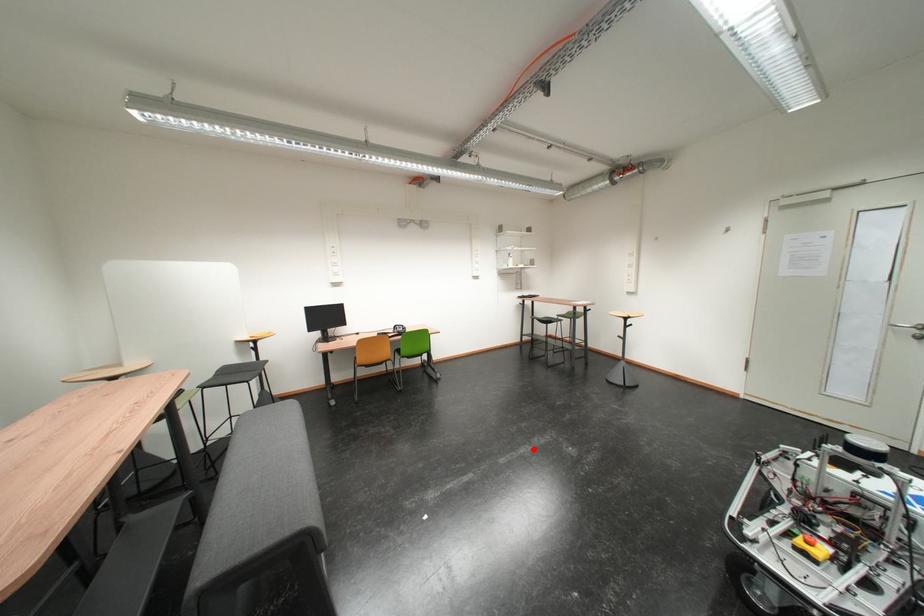
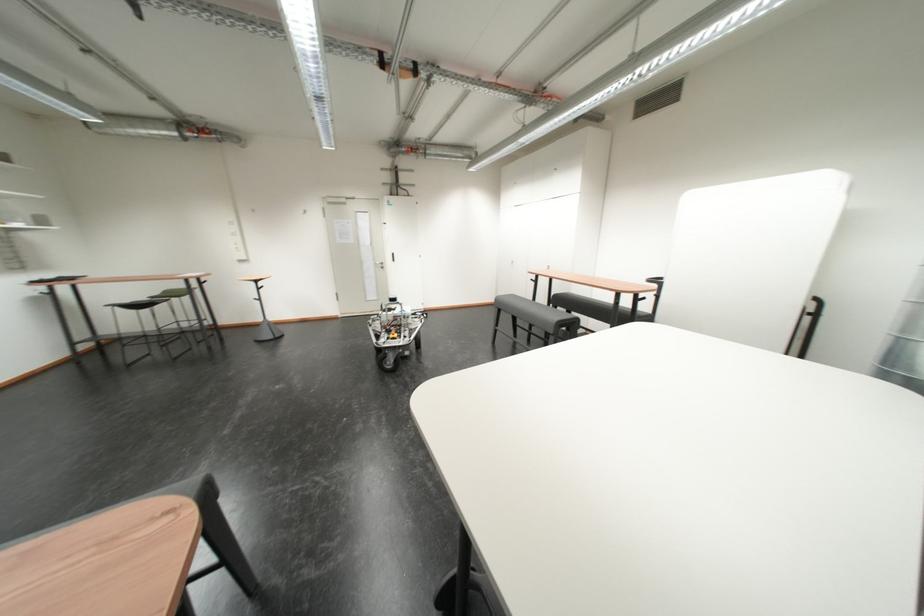
Locate, in the second image, the point that corresponds to the highlighted location in the first image.

(246, 416)